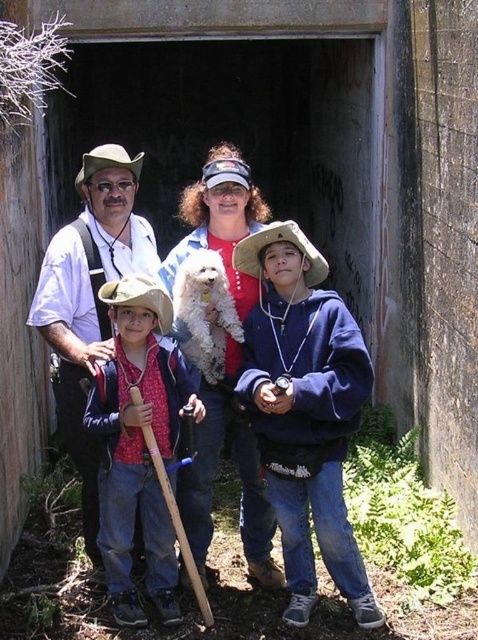
You are a photographer trying to capture a group photo of the matte red shirt at center and the matte white shirt at center. You want to ensure that both shirts are clearly visible in the frame. Based on their positions, which shirt should you focus on first to ensure it is in focus?

The matte red shirt at center is below the matte white shirt at center, so you should focus on the matte white shirt at center first as it is higher up and might be further away, ensuring both are in focus.

You are a photographer trying to capture a clear shot of both the brown straw cowboy hat at center and the brown straw hat at center. Since you want to ensure both are visible, which hat should you focus on first to avoid blurring due to their positions?

The brown straw cowboy hat at center is located above the brown straw hat at center. To ensure both are visible and avoid blurring, focus on the brown straw cowboy hat at center first as it is higher up, then adjust slightly downward to capture the brown straw hat at center below it.

Based on the photo, you are a photographer trying to capture a group photo of the matte red shirt at center and the matte white shirt at center. Since you want to make sure both shirts are clearly visible, which shirt should you focus on first to ensure proper exposure, considering their sizes?

The matte red shirt at center has a smaller size compared to the matte white shirt at center. Therefore, you should focus on the matte red shirt at center first to ensure its details are captured clearly before adjusting for the larger matte white shirt at center.